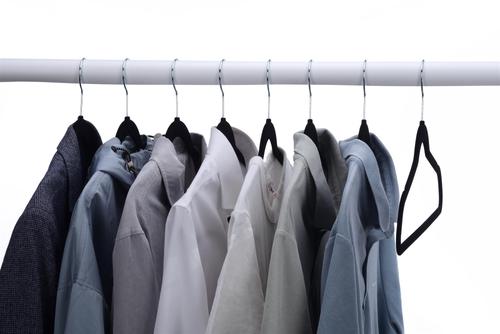
Where is `clothes hangers`? The width and height of the screenshot is (500, 334). clothes hangers is located at coordinates (424, 136), (368, 133), (310, 134), (271, 133), (226, 130), (182, 129), (132, 126), (86, 126).